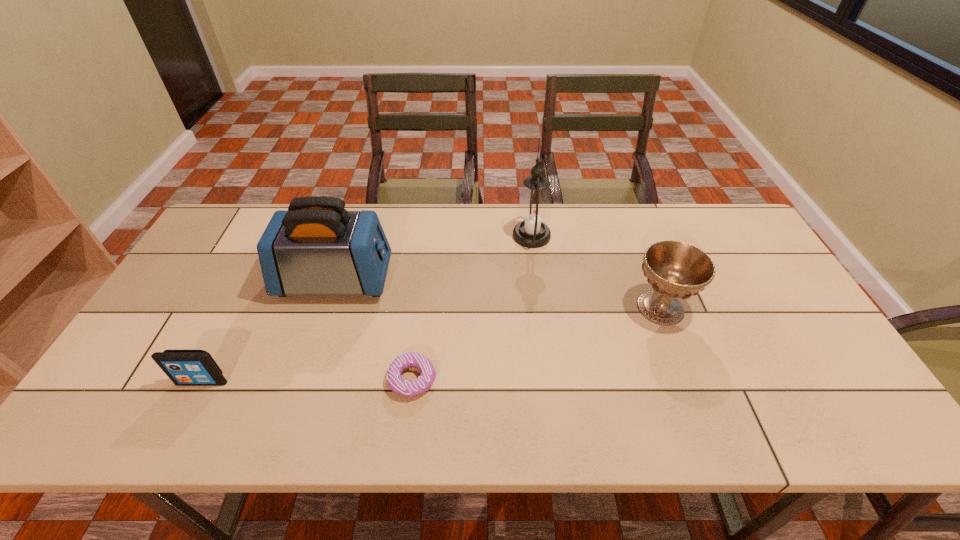
Where is `vacant space positioned 0.280m on the front of the farthest object`? Image resolution: width=960 pixels, height=540 pixels. vacant space positioned 0.280m on the front of the farthest object is located at coordinates (542, 322).

Locate an element on the screen. This screenshot has height=540, width=960. vacant space located on the front-facing side of the toaster is located at coordinates (466, 280).

Find the location of a particular element. vacant space located on the back of the third shortest object is located at coordinates (630, 227).

I want to click on vacant area located on the front screen of the iPod, so click(185, 414).

Where is `vacant area situated 0.360m on the left of the doughnut`? This screenshot has height=540, width=960. vacant area situated 0.360m on the left of the doughnut is located at coordinates (237, 380).

You are a GUI agent. You are given a task and a screenshot of the screen. Output one action in this format:
    pyautogui.click(x=<x>, y=<y>)
    Task: Click on the object present at the far edge
    The height and width of the screenshot is (540, 960).
    Given the screenshot: What is the action you would take?
    pyautogui.click(x=534, y=211)

Where is `object that is at the near edge`? The width and height of the screenshot is (960, 540). object that is at the near edge is located at coordinates (405, 388).

Where is `object positioned at the left edge`? The width and height of the screenshot is (960, 540). object positioned at the left edge is located at coordinates (184, 367).

Locate an element on the screen. The height and width of the screenshot is (540, 960). vacant space at the far edge of the desktop is located at coordinates (638, 226).

At what (x,y) coordinates should I click in order to perform the action: click on vacant region at the near edge of the desktop. Please return your answer as a coordinate pair (x, y). Looking at the image, I should click on (465, 414).